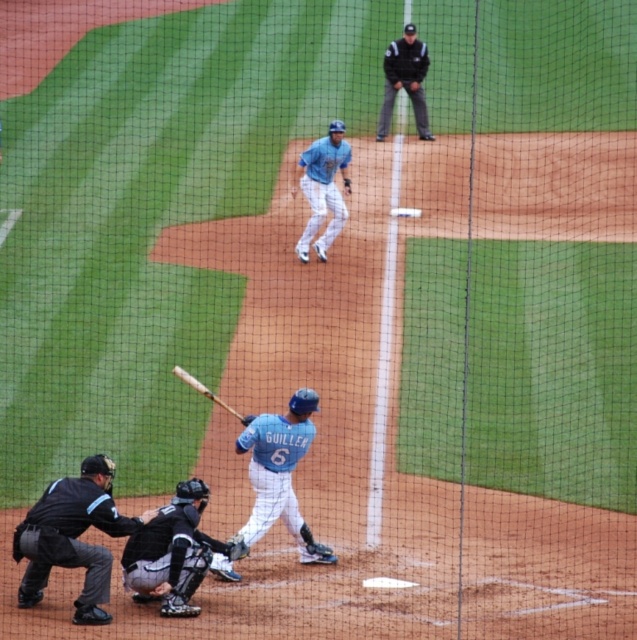
Question: Is light blue uniform at center in front of light blue jersey at upper center?

Choices:
 (A) no
 (B) yes

Answer: (B)

Question: Considering the real-world distances, which object is farthest from the dark brown leather glove at lower center?

Choices:
 (A) dark gray uniform at upper center
 (B) light blue jersey at upper center
 (C) wooden baseball bat at center
 (D) black leather catcher at lower left

Answer: (A)

Question: Which of the following is the closest to the observer?

Choices:
 (A) (306, 172)
 (B) (141, 536)
 (C) (89, 552)
 (D) (268, 464)

Answer: (C)

Question: Does light blue uniform at center appear over dark brown leather glove at lower center?

Choices:
 (A) no
 (B) yes

Answer: (B)

Question: Can you confirm if dark gray uniform at upper center is positioned above wooden baseball bat at center?

Choices:
 (A) yes
 (B) no

Answer: (A)

Question: Which point is farther from the camera taking this photo?

Choices:
 (A) (415, 44)
 (B) (234, 556)
 (C) (327, 173)
 (D) (196, 576)

Answer: (A)